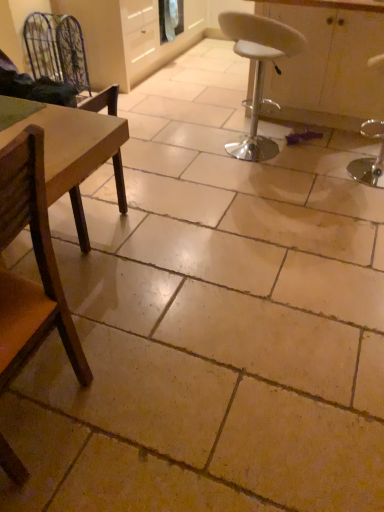
Question: In terms of width, does white glossy cabinet at center look wider or thinner when compared to metallic wire swivel chair at upper left?

Choices:
 (A) wide
 (B) thin

Answer: (A)

Question: Does point (365, 30) appear closer or farther from the camera than point (29, 45)?

Choices:
 (A) closer
 (B) farther

Answer: (A)

Question: Which object is positioned farthest from the wooden chair at left, the 3th chair positioned from the right?

Choices:
 (A) metallic wire swivel chair at upper left
 (B) brown wooden chair at left, placed as the 2th chair when sorted from left to right
 (C) white glossy cabinet at center
 (D) white plastic stool at center, the third chair viewed from the front

Answer: (A)

Question: Estimate the real-world distances between objects in this image. Which object is closer to the metallic wire swivel chair at upper left?

Choices:
 (A) wooden chair at left, placed as the 1th chair when sorted from left to right
 (B) white glossy cabinet at center
 (C) brown wooden chair at left, which is the first chair in front-to-back order
 (D) white plastic stool at center, which is counted as the first chair, starting from the right

Answer: (D)